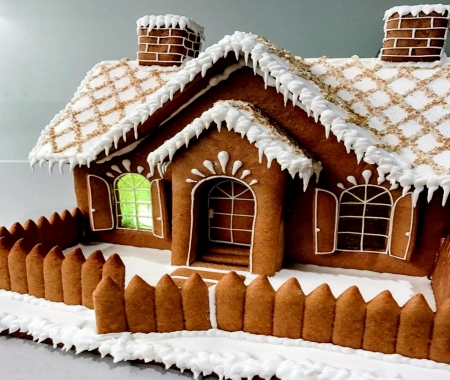
Where is `shutters`? The image size is (450, 380). shutters is located at coordinates (97, 198), (156, 205), (326, 211), (400, 227).